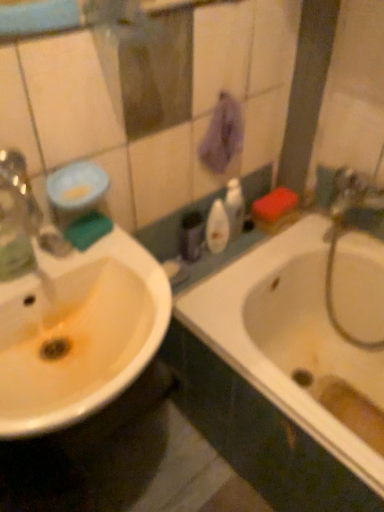
Locate an element on the screen. Image resolution: width=384 pixels, height=512 pixels. space that is in front of matte purple container at center, arranged as the 2th toiletry when viewed from the right is located at coordinates (188, 281).